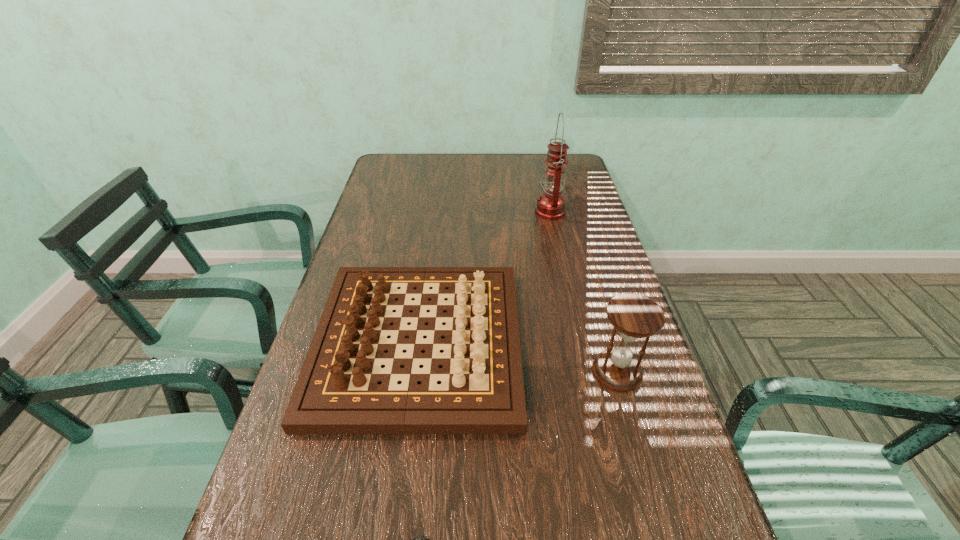
This screenshot has width=960, height=540. In order to click on free region at the far edge of the desktop in this screenshot , I will do `click(482, 163)`.

Where is `vacant area at the left edge of the desktop`? vacant area at the left edge of the desktop is located at coordinates (319, 526).

Identify the location of vacant space at the right edge of the desktop. The width and height of the screenshot is (960, 540). tap(657, 370).

You are a GUI agent. You are given a task and a screenshot of the screen. Output one action in this format:
    pyautogui.click(x=<x>, y=<y>)
    Task: Click on the vacant point located between the hourglass and the oil lamp
    The height and width of the screenshot is (540, 960).
    Given the screenshot: What is the action you would take?
    pyautogui.click(x=584, y=292)

Where is `the second closest object relative to the third shortest object`? This screenshot has width=960, height=540. the second closest object relative to the third shortest object is located at coordinates (415, 539).

Identify which object is located as the third nearest to the hourglass. Please provide its 2D coordinates. Your answer should be formatted as a tuple, i.e. [(x, y)], where the tuple contains the x and y coordinates of a point satisfying the conditions above.

[(551, 204)]

This screenshot has width=960, height=540. I want to click on blank space that satisfies the following two spatial constraints: 1. on the front side of the farthest object; 2. on the side with the white pieces of the gameboard, so click(579, 342).

Find the location of a particular element. blank space that satisfies the following two spatial constraints: 1. on the side with the white pieces of the gameboard; 2. on the left side of the hourglass is located at coordinates (415, 372).